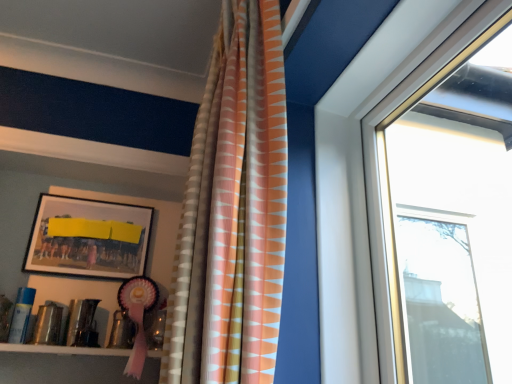
Question: Considering the positions of point (208, 324) and point (109, 225), is point (208, 324) closer or farther from the camera than point (109, 225)?

Choices:
 (A) closer
 (B) farther

Answer: (A)

Question: Visually, is textured orange and white curtain at center positioned to the left or to the right of matte black picture frame at upper left?

Choices:
 (A) right
 (B) left

Answer: (A)

Question: Looking at their shapes, would you say textured orange and white curtain at center is wider or thinner than matte black picture frame at upper left?

Choices:
 (A) thin
 (B) wide

Answer: (B)

Question: Looking at the image, does matte black picture frame at upper left seem bigger or smaller compared to textured orange and white curtain at center?

Choices:
 (A) small
 (B) big

Answer: (A)

Question: Does point (138, 241) appear closer or farther from the camera than point (262, 193)?

Choices:
 (A) closer
 (B) farther

Answer: (B)

Question: From the image's perspective, is matte black picture frame at upper left above or below textured orange and white curtain at center?

Choices:
 (A) below
 (B) above

Answer: (A)

Question: From a real-world perspective, is matte black picture frame at upper left positioned above or below textured orange and white curtain at center?

Choices:
 (A) above
 (B) below

Answer: (A)